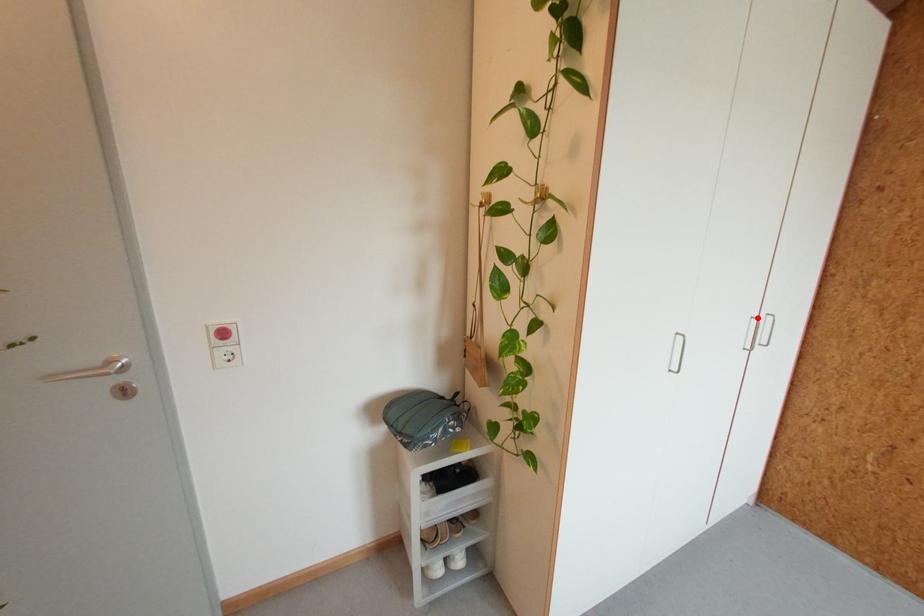
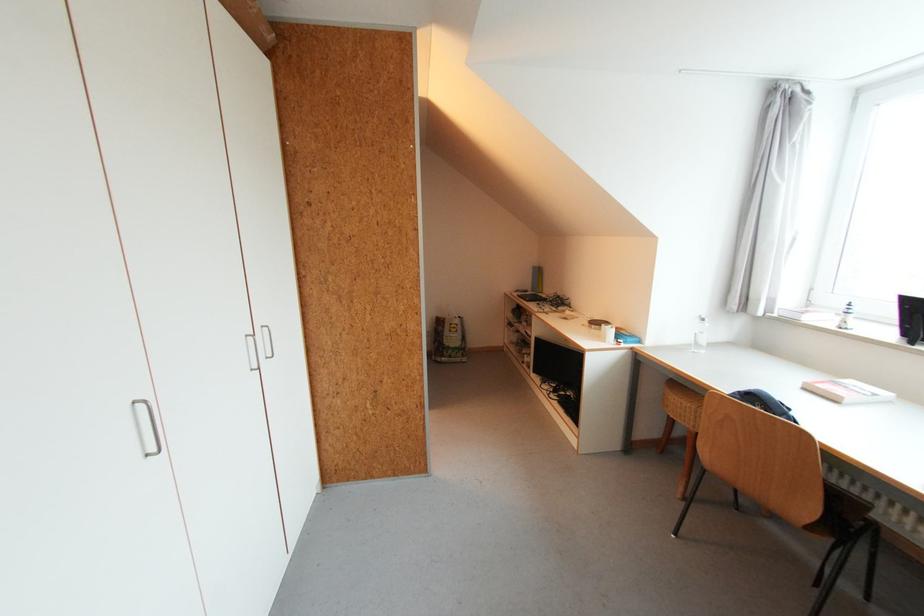
Locate, in the second image, the point that corresponds to the highlighted location in the first image.

(251, 336)